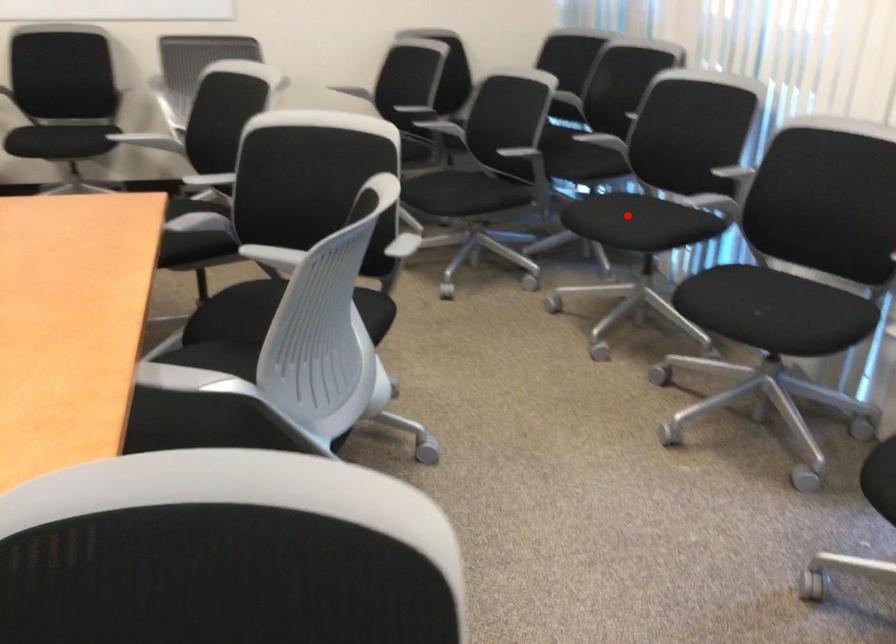
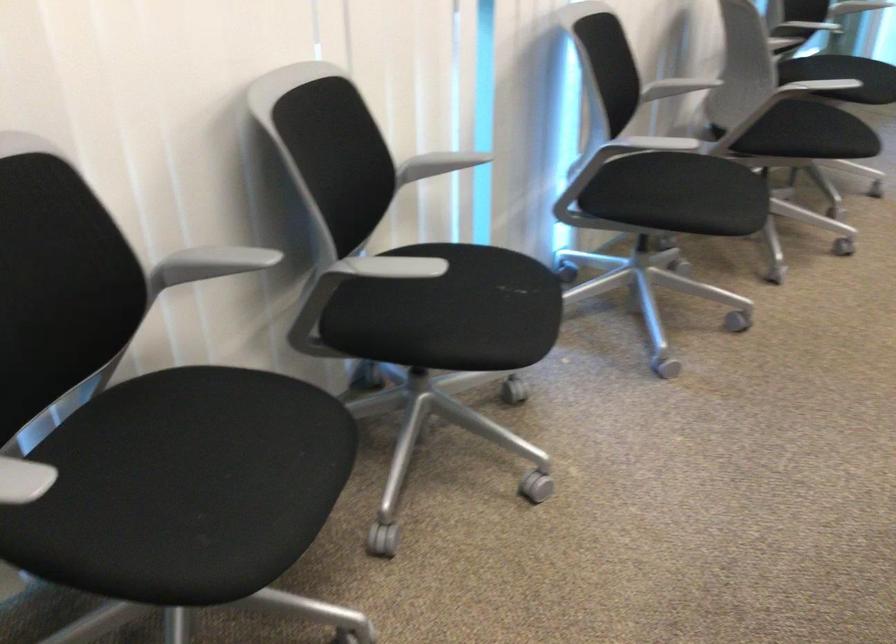
Question: I am providing you with two images of the same scene from different viewpoints. In image1, a red point is highlighted. Considering the same 3D point in image2, which of the following is correct?

Choices:
 (A) It is closer
 (B) It is farther

Answer: (A)